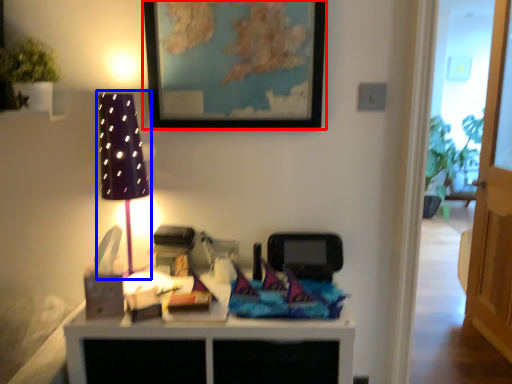
Question: Which object is closer to the camera taking this photo, picture frame (highlighted by a red box) or table lamp (highlighted by a blue box)?

Choices:
 (A) picture frame
 (B) table lamp

Answer: (B)